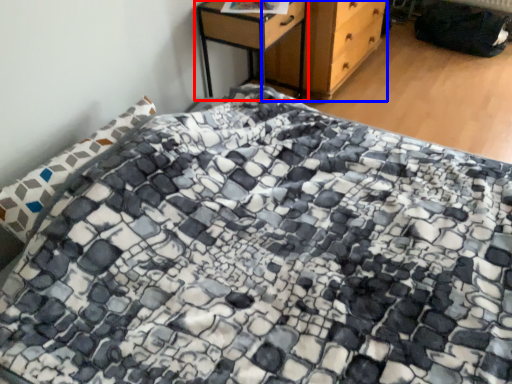
Question: Which object appears farthest to the camera in this image, nightstand (highlighted by a red box) or chest of drawers (highlighted by a blue box)?

Choices:
 (A) nightstand
 (B) chest of drawers

Answer: (B)